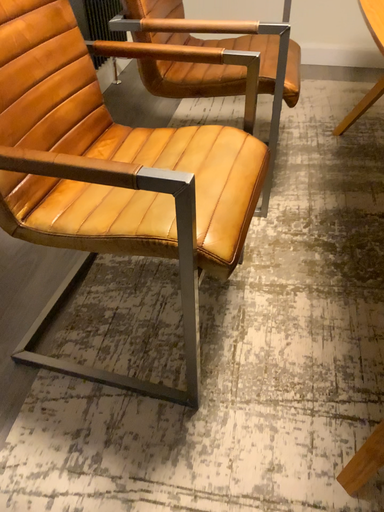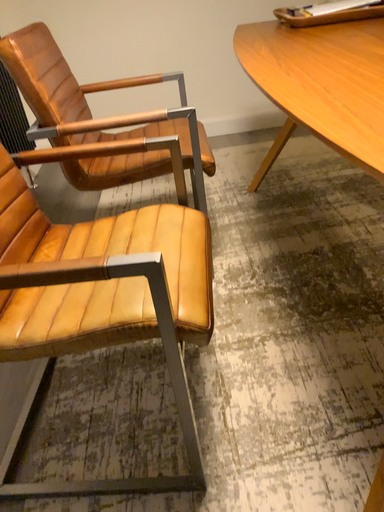
Question: How did the camera likely rotate when shooting the video?

Choices:
 (A) rotated downward
 (B) rotated upward

Answer: (B)